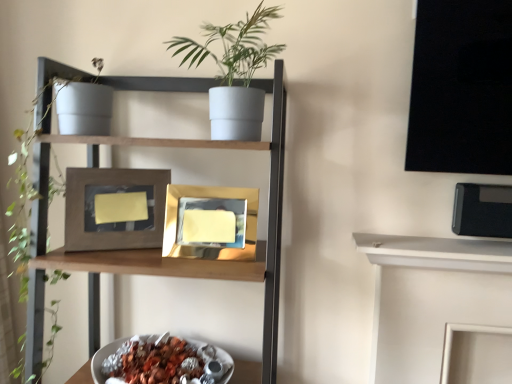
The height and width of the screenshot is (384, 512). What do you see at coordinates (116, 186) in the screenshot? I see `matte brown picture frame at center, which appears as the first picture frame when viewed from the left` at bounding box center [116, 186].

Where is `matte brown picture frame at center, which appears as the first picture frame when viewed from the left`? The width and height of the screenshot is (512, 384). matte brown picture frame at center, which appears as the first picture frame when viewed from the left is located at coordinates (116, 186).

Measure the distance between point (170, 247) and camera.

3.40 feet.

Identify the location of matte gray pot at upper left. (52, 87).

Is point (128, 350) closer to viewer compared to point (45, 83)?

No, (128, 350) is behind (45, 83).

Which object is thinner, shiny metallic bowl at lower center or matte gray pot at upper left?

Thinner between the two is shiny metallic bowl at lower center.

Find the location of a particular element. The height and width of the screenshot is (384, 512). plant on the left of shiny metallic bowl at lower center is located at coordinates (52, 87).

Looking at this image, considering their positions, is matte gray pot at upper left located in front of or behind matte brown picture frame at center, acting as the second picture frame starting from the right?

In the image, matte gray pot at upper left appears in front of matte brown picture frame at center, acting as the second picture frame starting from the right.

Which is behind, point (46, 198) or point (64, 246)?

Positioned behind is point (46, 198).

Is matte gray pot at upper left positioned with its back to matte brown picture frame at center, which appears as the first picture frame when viewed from the left?

Yes.

Considering the sizes of objects matte gray pot at upper left and matte brown picture frame at center, acting as the second picture frame starting from the right, in the image provided, who is smaller, matte gray pot at upper left or matte brown picture frame at center, acting as the second picture frame starting from the right,?

matte brown picture frame at center, acting as the second picture frame starting from the right, is smaller.

From the image's perspective, who appears lower, matte brown picture frame at center, acting as the second picture frame starting from the right, or matte gray pot at upper center?

matte gray pot at upper center, from the image's perspective.

Is matte gray pot at upper center located within matte brown picture frame at center, acting as the second picture frame starting from the right?

That's incorrect, matte gray pot at upper center is not inside matte brown picture frame at center, acting as the second picture frame starting from the right.

From a real-world perspective, who is located higher, matte brown picture frame at center, acting as the second picture frame starting from the right, or matte gray pot at upper center?

matte brown picture frame at center, acting as the second picture frame starting from the right.

Is matte brown picture frame at center, which appears as the first picture frame when viewed from the left, positioned with its back to matte gray pot at upper center?

Yes, matte brown picture frame at center, which appears as the first picture frame when viewed from the left, is facing away from matte gray pot at upper center.

In order to click on the 1st picture frame below the white matte pot at upper center (from the image's perspective) in this screenshot , I will do `click(116, 186)`.

From the image's perspective, is white matte pot at upper center beneath matte brown picture frame at center, acting as the second picture frame starting from the right?

Actually, white matte pot at upper center appears above matte brown picture frame at center, acting as the second picture frame starting from the right, in the image.

Looking at this image, is white matte pot at upper center wider than matte brown picture frame at center, which appears as the first picture frame when viewed from the left?

Indeed, white matte pot at upper center has a greater width compared to matte brown picture frame at center, which appears as the first picture frame when viewed from the left.

Is white matte pot at upper center smaller than matte brown picture frame at center, acting as the second picture frame starting from the right?

No, white matte pot at upper center is not smaller than matte brown picture frame at center, acting as the second picture frame starting from the right.

Can you confirm if matte gray pot at upper center is wider than gold reflective photo frame at center, the 2th picture frame from the left?

Yes.

From a real-world perspective, is matte gray pot at upper center located higher than gold reflective photo frame at center, the 2th picture frame from the left?

No, from a real-world perspective, matte gray pot at upper center is not above gold reflective photo frame at center, the 2th picture frame from the left.

Is point (49, 140) in front of point (181, 194)?

Yes, point (49, 140) is closer to viewer.

Is matte gray pot at upper center closer to camera compared to gold reflective photo frame at center, the 2th picture frame from the left?

Yes.

From a real-world perspective, is matte brown picture frame at center, acting as the second picture frame starting from the right, below white matte pot at upper center?

Yes.

Identify the location of houseplant above the matte brown picture frame at center, acting as the second picture frame starting from the right (from the image's perspective). The height and width of the screenshot is (384, 512). (234, 72).

From the image's perspective, is gold reflective photo frame at center, the 2th picture frame from the left, under matte brown picture frame at center, acting as the second picture frame starting from the right?

Indeed, from the image's perspective, gold reflective photo frame at center, the 2th picture frame from the left, is shown beneath matte brown picture frame at center, acting as the second picture frame starting from the right.

In the scene shown: Between gold reflective photo frame at center, the first picture frame viewed from the right, and matte brown picture frame at center, which appears as the first picture frame when viewed from the left, which one appears on the right side from the viewer's perspective?

From the viewer's perspective, gold reflective photo frame at center, the first picture frame viewed from the right, appears more on the right side.

The image size is (512, 384). I want to click on picture frame in front of the matte brown picture frame at center, which appears as the first picture frame when viewed from the left, so click(x=199, y=197).

Looking at this image, is matte brown picture frame at center, acting as the second picture frame starting from the right, a part of gold reflective photo frame at center, the 2th picture frame from the left?

No, matte brown picture frame at center, acting as the second picture frame starting from the right, is not a part of gold reflective photo frame at center, the 2th picture frame from the left.

Identify the location of plant on the left of shiny metallic bowl at lower center. The width and height of the screenshot is (512, 384). (52, 87).

I want to click on the 2nd picture frame above when counting from the matte gray pot at upper left (from the image's perspective), so click(x=116, y=186).

From the image, which object appears to be nearer to matte gray pot at upper center, shiny metallic bowl at lower center or matte gray pot at upper left?

The object closer to matte gray pot at upper center is matte gray pot at upper left.

Based on their spatial positions, is matte gray pot at upper center or shiny metallic bowl at lower center further from matte brown picture frame at center, acting as the second picture frame starting from the right?

The object further to matte brown picture frame at center, acting as the second picture frame starting from the right, is shiny metallic bowl at lower center.

Which object lies nearer to the anchor point shiny metallic bowl at lower center, matte gray pot at upper left or matte gray pot at upper center?

matte gray pot at upper center.

Which object lies further to the anchor point white matte pot at upper center, matte brown picture frame at center, acting as the second picture frame starting from the right, or matte gray pot at upper center?

matte brown picture frame at center, acting as the second picture frame starting from the right.

Estimate the real-world distances between objects in this image. Which object is further from gold reflective photo frame at center, the first picture frame viewed from the right, matte brown picture frame at center, acting as the second picture frame starting from the right, or shiny metallic bowl at lower center?

The object further to gold reflective photo frame at center, the first picture frame viewed from the right, is shiny metallic bowl at lower center.

Considering their positions, is matte brown picture frame at center, which appears as the first picture frame when viewed from the left, positioned closer to matte gray pot at upper left than gold reflective photo frame at center, the first picture frame viewed from the right?

matte brown picture frame at center, which appears as the first picture frame when viewed from the left, is closer to matte gray pot at upper left.

Based on their spatial positions, is shiny metallic bowl at lower center or white matte pot at upper center closer to gold reflective photo frame at center, the 2th picture frame from the left?

white matte pot at upper center lies closer to gold reflective photo frame at center, the 2th picture frame from the left, than the other object.

Estimate the real-world distances between objects in this image. Which object is closer to shiny metallic bowl at lower center, gold reflective photo frame at center, the 2th picture frame from the left, or matte gray pot at upper center?

Among the two, matte gray pot at upper center is located nearer to shiny metallic bowl at lower center.

Where is `plant between white matte pot at upper center and matte gray pot at upper center in the up-down direction`? Image resolution: width=512 pixels, height=384 pixels. plant between white matte pot at upper center and matte gray pot at upper center in the up-down direction is located at coordinates (52, 87).

Identify the location of plant between matte brown picture frame at center, which appears as the first picture frame when viewed from the left, and shiny metallic bowl at lower center vertically. (52, 87).

Locate an element on the screen. shelf between matte gray pot at upper left and shiny metallic bowl at lower center vertically is located at coordinates (190, 261).

You are a GUI agent. You are given a task and a screenshot of the screen. Output one action in this format:
    pyautogui.click(x=<x>, y=<y>)
    Task: Click on the plant that lies between gold reflective photo frame at center, the first picture frame viewed from the right, and shiny metallic bowl at lower center from top to bottom
    
    Given the screenshot: What is the action you would take?
    pyautogui.click(x=52, y=87)